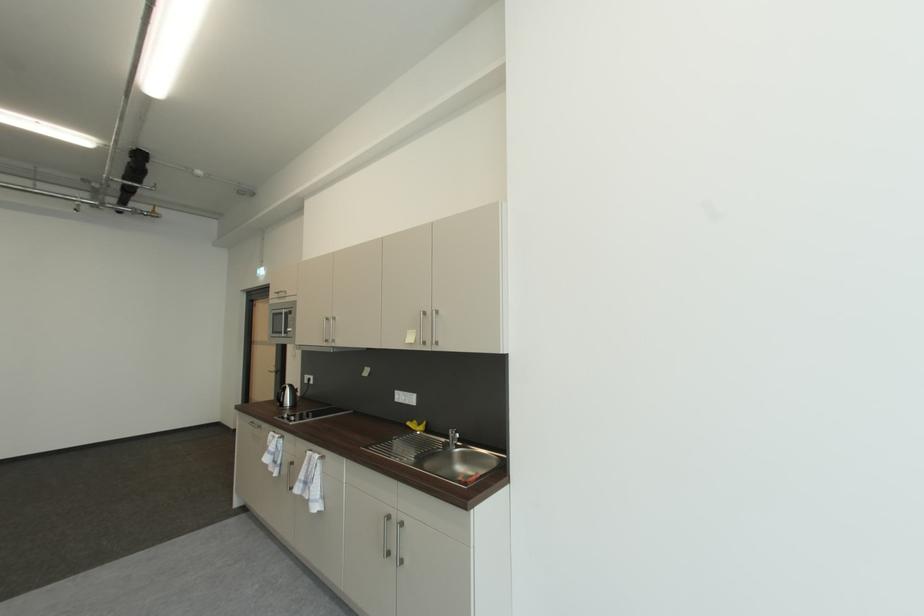
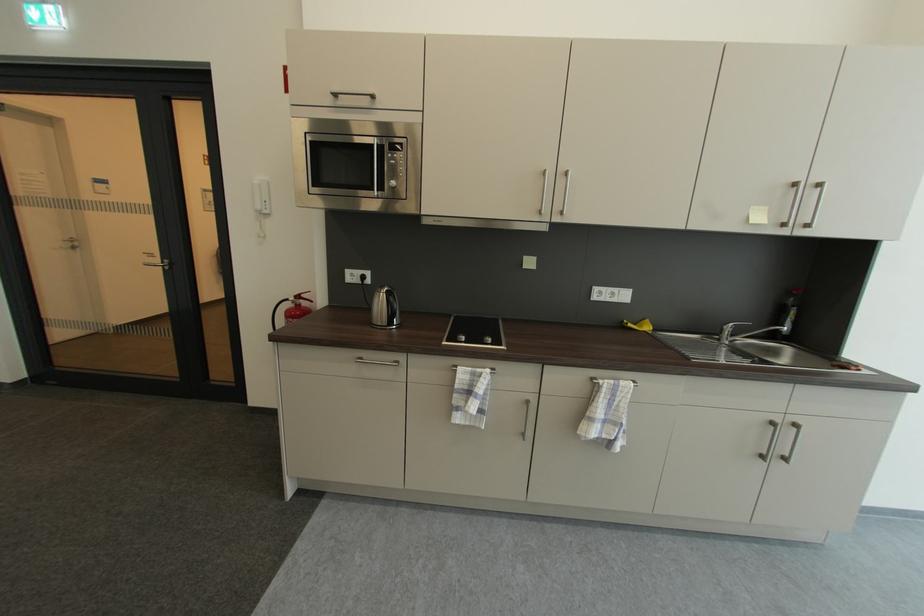
In the second image, find the point that corresponds to (287,392) in the first image.

(397, 301)